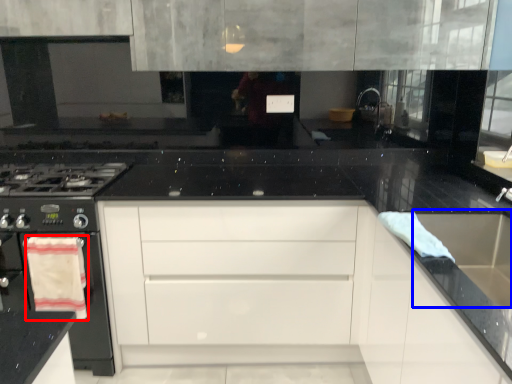
Question: Which of the following is the closest to the observer, material (highlighted by a red box) or sink (highlighted by a blue box)?

Choices:
 (A) material
 (B) sink

Answer: (B)